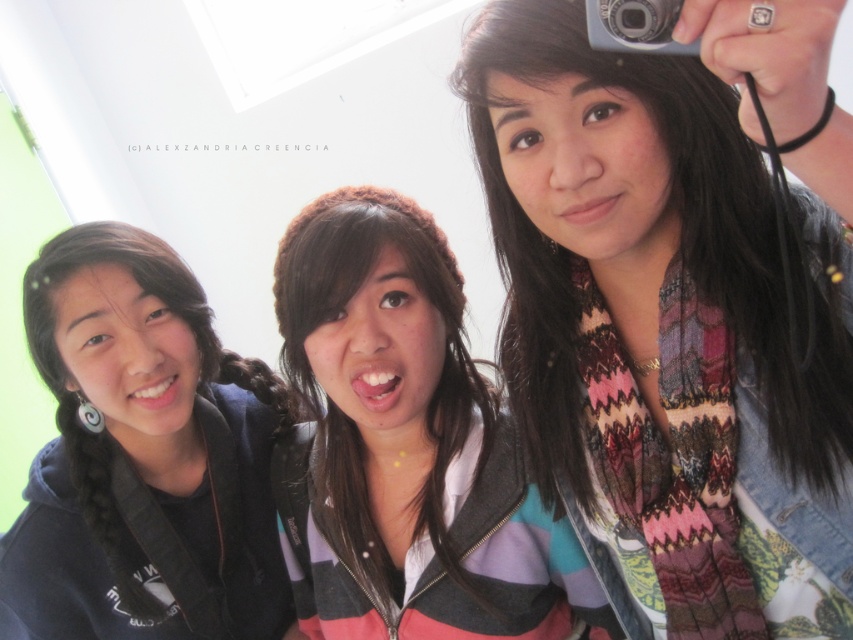
Is black matte hoodie at left further to the viewer compared to silver metallic camera at upper right?

That is True.

Does black matte hoodie at left have a greater width compared to silver metallic camera at upper right?

Indeed, black matte hoodie at left has a greater width compared to silver metallic camera at upper right.

Is point (225, 394) less distant than point (614, 48)?

No.

I want to click on black matte hoodie at left, so click(x=142, y=458).

Who is higher up, striped hoodie at center or black matte hoodie at left?

striped hoodie at center is above.

Locate an element on the screen. This screenshot has width=853, height=640. striped hoodie at center is located at coordinates (x=405, y=445).

Find the location of a particular element. The width and height of the screenshot is (853, 640). striped hoodie at center is located at coordinates (405, 445).

Find the location of a particular element. This screenshot has height=640, width=853. striped hoodie at center is located at coordinates (405, 445).

Is the position of multicolored scarf at center less distant than that of striped hoodie at center?

Yes, multicolored scarf at center is in front of striped hoodie at center.

Between multicolored scarf at center and striped hoodie at center, which one has less height?

multicolored scarf at center is shorter.

Locate an element on the screen. This screenshot has width=853, height=640. multicolored scarf at center is located at coordinates (677, 308).

Locate an element on the screen. multicolored scarf at center is located at coordinates (677, 308).